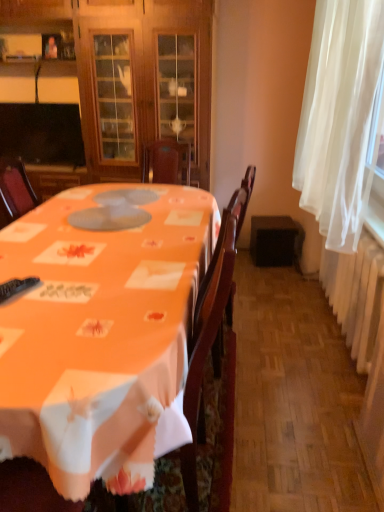
Where is `free spot to the right of black plastic remote control at lower left`? The image size is (384, 512). free spot to the right of black plastic remote control at lower left is located at coordinates (66, 295).